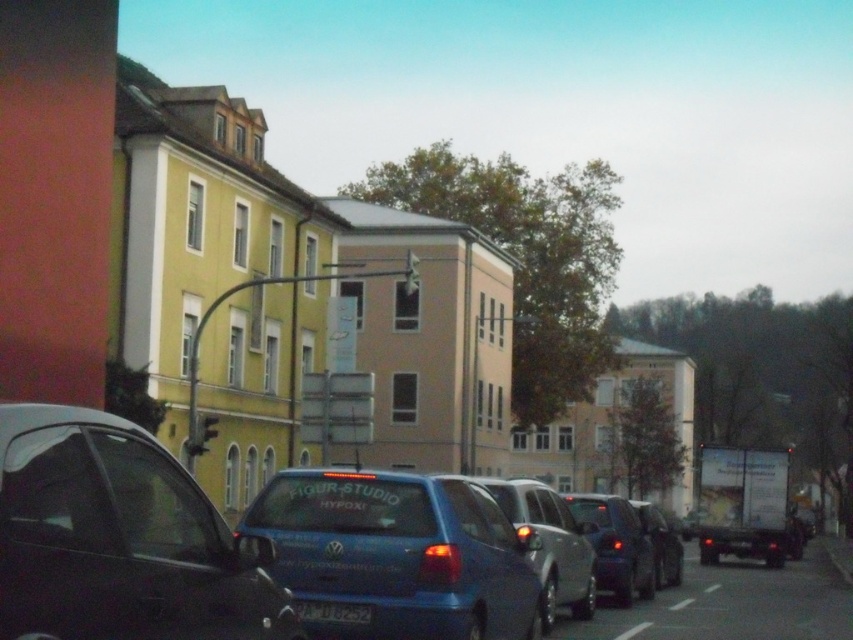
Question: Is metallic gray traffic light at center positioned in front of white plastic line at lower center?

Choices:
 (A) yes
 (B) no

Answer: (B)

Question: Which is nearer to the matte black car at lower left?

Choices:
 (A) white rubber line at center
 (B) black plastic license plate at lower center
 (C) blue metallic car at center

Answer: (B)

Question: Which point is closer to the camera?

Choices:
 (A) blue metallic car at center
 (B) white rubber line at center
 (C) metallic gray traffic light at center

Answer: (A)

Question: Can you confirm if blue matte car at center is positioned above metallic blue sedan at center?

Choices:
 (A) yes
 (B) no

Answer: (A)

Question: Which object is farther from the camera taking this photo?

Choices:
 (A) blue metallic car at center
 (B) matte black car at lower left
 (C) white rubber line at center
 (D) black plastic license plate at lower center

Answer: (C)

Question: Considering the relative positions of white rubber line at center and white plastic line at lower center in the image provided, where is white rubber line at center located with respect to white plastic line at lower center?

Choices:
 (A) above
 (B) below

Answer: (B)